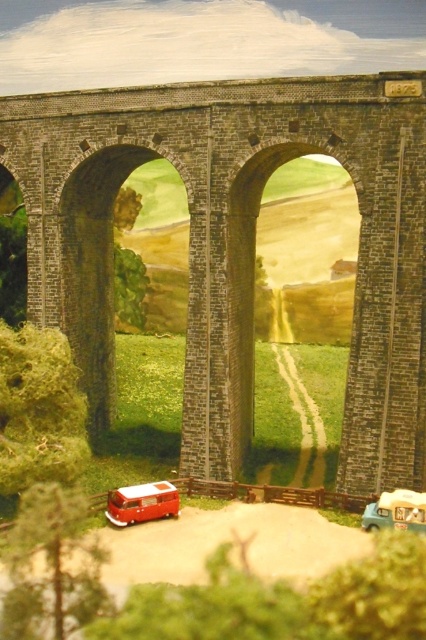
Question: Which object is the farthest from the brick stone bridge at center?

Choices:
 (A) shiny red van at lower left
 (B) matte white van at lower right

Answer: (B)

Question: Can you confirm if brick stone bridge at center is bigger than matte white van at lower right?

Choices:
 (A) yes
 (B) no

Answer: (A)

Question: Can you confirm if shiny red van at lower left is smaller than matte white van at lower right?

Choices:
 (A) yes
 (B) no

Answer: (A)

Question: Which point is farther from the camera taking this photo?

Choices:
 (A) (106, 176)
 (B) (400, 500)
 (C) (138, 512)

Answer: (A)

Question: Can you confirm if shiny red van at lower left is wider than matte white van at lower right?

Choices:
 (A) no
 (B) yes

Answer: (B)

Question: Among these points, which one is farthest from the camera?

Choices:
 (A) pos(267,93)
 (B) pos(423,508)
 (C) pos(123,497)

Answer: (A)